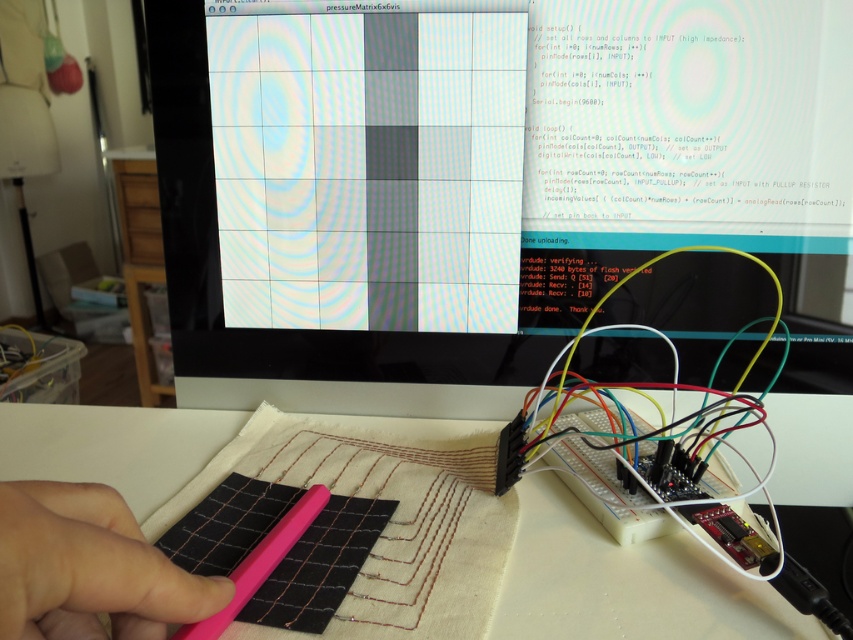
You are setting up a new electronic project and need to place a pink rubber at lower left near the matte plastic monitor at center. Based on the workspace layout, where should you position the pink rubber relative to the monitor?

The matte plastic monitor at center is positioned on the right side of pink rubber at lower left, so you should place the pink rubber to the left of the matte plastic monitor at center.